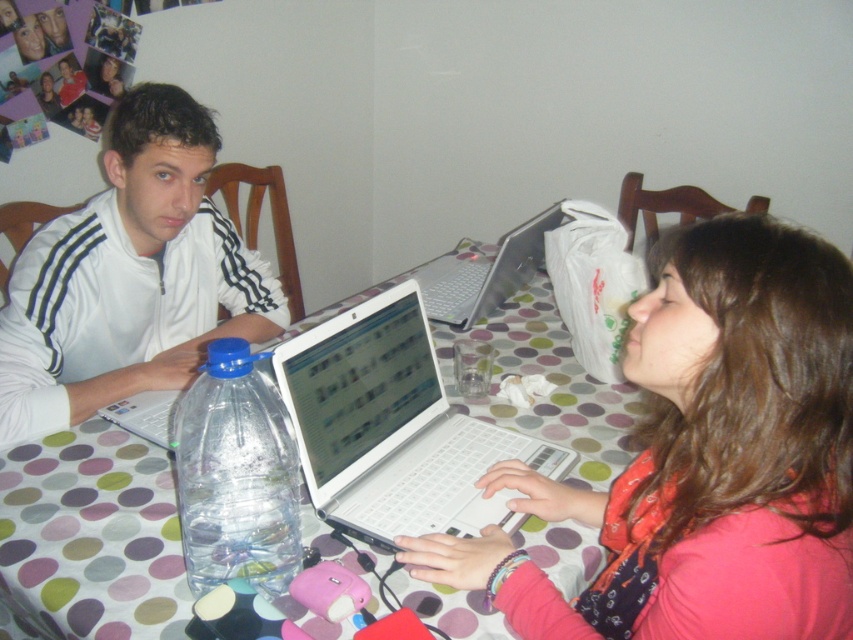
You are standing in front of a table with a polka dot tablecloth. There is a point marked at coordinates (838, 515). If you want to place a 28 inch ruler on the table so that one end touches this point, will the ruler extend beyond the edge of the table?

The point at (838, 515) is 27.84 inches from the camera. Since the ruler is 28 inches long, placing it so one end touches this point would mean the other end extends 0.16 inches beyond the table edge.

Based on the photo, you are at a table with a polka dot tablecloth and need to place a new item at the coordinates point (704, 458). What object is already located there?

The point (704, 458) corresponds to the matte white laptop at center, so the matte white laptop at center is already there.

You are a guest at a cafe and see the white matte jacket at upper left and the clear plastic bottle at center on the table. Which item is closer to the edge of the table?

The clear plastic bottle at center is closer to the edge of the table because it is positioned below the white matte jacket at upper left, which is placed higher up on the table.